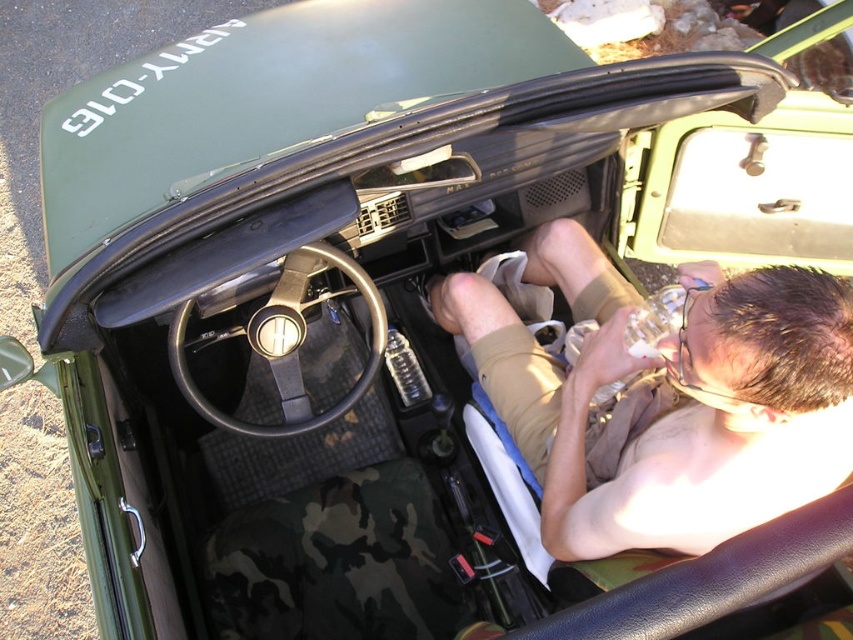
Who is lower down, tan fabric leg at center or black rubber steering wheel at center?

Positioned lower is tan fabric leg at center.

Does tan fabric leg at center have a lesser height compared to black rubber steering wheel at center?

In fact, tan fabric leg at center may be taller than black rubber steering wheel at center.

Is point (790, 356) positioned behind point (173, 332)?

That is False.

Identify the location of tan fabric leg at center. The image size is (853, 640). (666, 397).